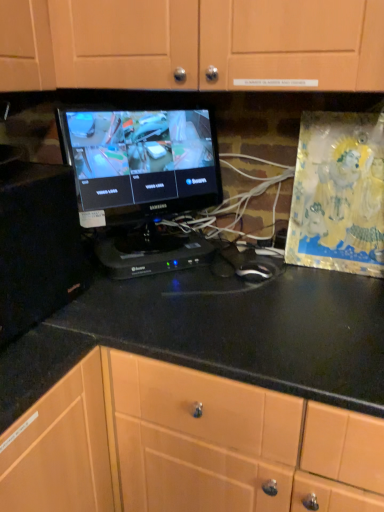
What do you see at coordinates (190, 42) in the screenshot? I see `matte wood cabinet at upper center, marked as the first cabinetry in a top-to-bottom arrangement` at bounding box center [190, 42].

Where is `black matte cabinet at left, which ranks as the 1th cabinetry in left-to-right order`? black matte cabinet at left, which ranks as the 1th cabinetry in left-to-right order is located at coordinates (37, 245).

Measure the distance between black glossy monitor at center and camera.

black glossy monitor at center is 39.07 inches from camera.

You are a GUI agent. You are given a task and a screenshot of the screen. Output one action in this format:
    pyautogui.click(x=<x>, y=<y>)
    Task: Click on the matte wood cabinet at upper center, which is the 2th cabinetry in bottom-to-top order
    This screenshot has height=512, width=384.
    Given the screenshot: What is the action you would take?
    pyautogui.click(x=190, y=42)

In the image, there is a matte wood cabinet at upper center, which is the 2th cabinetry from left to right. Where is `computer monitor below it (from a real-world perspective)`? This screenshot has height=512, width=384. computer monitor below it (from a real-world perspective) is located at coordinates (141, 182).

Can you tell me how much matte wood cabinet at upper center, which is the 2th cabinetry in bottom-to-top order, and black glossy monitor at center differ in facing direction?

They differ by 52.5 degrees in their facing directions.

From a real-world perspective, is matte wood cabinet at upper center, which is the 2th cabinetry in bottom-to-top order, located higher than black glossy monitor at center?

Yes.

Measure the distance between matte wood cabinet at upper center, the 1th cabinetry from the right, and black glossy monitor at center.

matte wood cabinet at upper center, the 1th cabinetry from the right, and black glossy monitor at center are 11.45 inches apart.

Which is correct: black glossy monitor at center is inside matte wood cabinet at upper center, which is the 2th cabinetry in bottom-to-top order, or outside of it?

black glossy monitor at center is spatially situated outside matte wood cabinet at upper center, which is the 2th cabinetry in bottom-to-top order.

Considering the positions of objects black glossy monitor at center and matte wood cabinet at upper center, the 1th cabinetry from the right, in the image provided, who is more to the left, black glossy monitor at center or matte wood cabinet at upper center, the 1th cabinetry from the right,?

black glossy monitor at center.

Can you tell me how much black glossy monitor at center and matte wood cabinet at upper center, which is the 2th cabinetry in bottom-to-top order, differ in facing direction?

52.5 degrees.

From the image's perspective, which one is positioned lower, black glossy monitor at center or matte wood cabinet at upper center, which is the 2th cabinetry from left to right?

black glossy monitor at center.

Looking at this image, what's the angular difference between black glossy countertop at center and black matte cabinet at left, which ranks as the 1th cabinetry in left-to-right order,'s facing directions?

Result: The angle between the facing direction of black glossy countertop at center and the facing direction of black matte cabinet at left, which ranks as the 1th cabinetry in left-to-right order, is 90.8 degrees.

Is black glossy countertop at center further to camera compared to black matte cabinet at left, which ranks as the 1th cabinetry in left-to-right order?

No, it is in front of black matte cabinet at left, which ranks as the 1th cabinetry in left-to-right order.

Which object is positioned more to the left, black glossy countertop at center or black matte cabinet at left, which ranks as the 1th cabinetry in left-to-right order?

Positioned to the left is black matte cabinet at left, which ranks as the 1th cabinetry in left-to-right order.

Is black glossy countertop at center looking in the opposite direction of black matte cabinet at left, the second cabinetry in the top-to-bottom sequence?

No, black matte cabinet at left, the second cabinetry in the top-to-bottom sequence, is not at the back of black glossy countertop at center.

Can you tell me how much black matte cabinet at left, which ranks as the first cabinetry in bottom-to-top order, and black glossy monitor at center differ in facing direction?

There is a 37.1-degree angle between the facing directions of black matte cabinet at left, which ranks as the first cabinetry in bottom-to-top order, and black glossy monitor at center.

Consider the image. Is black matte cabinet at left, which ranks as the 1th cabinetry in left-to-right order, taller than black glossy monitor at center?

No, black matte cabinet at left, which ranks as the 1th cabinetry in left-to-right order, is not taller than black glossy monitor at center.

In the image, is black matte cabinet at left, which ranks as the first cabinetry in bottom-to-top order, on the left side or the right side of black glossy monitor at center?

In the image, black matte cabinet at left, which ranks as the first cabinetry in bottom-to-top order, appears on the left side of black glossy monitor at center.

Is there a large distance between black matte cabinet at left, which ranks as the 1th cabinetry in left-to-right order, and black glossy monitor at center?

They are positioned close to each other.

From a real-world perspective, between matte wood cabinet at upper center, which is the 2th cabinetry in bottom-to-top order, and black matte cabinet at left, which is counted as the second cabinetry, starting from the right, who is vertically higher?

In real-world perspective, matte wood cabinet at upper center, which is the 2th cabinetry in bottom-to-top order, is above.

From the image's perspective, which one is positioned lower, matte wood cabinet at upper center, which is the 2th cabinetry from left to right, or black matte cabinet at left, the second cabinetry in the top-to-bottom sequence?

From the image's view, black matte cabinet at left, the second cabinetry in the top-to-bottom sequence, is below.

Considering the sizes of matte wood cabinet at upper center, which is the 2th cabinetry from left to right, and black matte cabinet at left, the second cabinetry in the top-to-bottom sequence, in the image, is matte wood cabinet at upper center, which is the 2th cabinetry from left to right, wider or thinner than black matte cabinet at left, the second cabinetry in the top-to-bottom sequence,?

matte wood cabinet at upper center, which is the 2th cabinetry from left to right, is wider than black matte cabinet at left, the second cabinetry in the top-to-bottom sequence.

Considering the relative positions of matte wood cabinet at upper center, marked as the first cabinetry in a top-to-bottom arrangement, and black matte cabinet at left, which is counted as the second cabinetry, starting from the right, in the image provided, is matte wood cabinet at upper center, marked as the first cabinetry in a top-to-bottom arrangement, to the right of black matte cabinet at left, which is counted as the second cabinetry, starting from the right, from the viewer's perspective?

Indeed, matte wood cabinet at upper center, marked as the first cabinetry in a top-to-bottom arrangement, is positioned on the right side of black matte cabinet at left, which is counted as the second cabinetry, starting from the right.

Is black glossy monitor at center aimed at black glossy countertop at center?

No, black glossy monitor at center is not facing towards black glossy countertop at center.

Based on the photo, can you tell me how much black glossy monitor at center and black glossy countertop at center differ in facing direction?

53.7 degrees.

From the image's perspective, is black glossy monitor at center beneath black glossy countertop at center?

No, from the image's perspective, black glossy monitor at center is not below black glossy countertop at center.

From a real-world perspective, is black glossy monitor at center over black glossy countertop at center?

Yes.

From their relative heights in the image, would you say black matte cabinet at left, the second cabinetry in the top-to-bottom sequence, is taller or shorter than matte wood cabinet at upper center, which is the 2th cabinetry in bottom-to-top order?

In the image, black matte cabinet at left, the second cabinetry in the top-to-bottom sequence, appears to be taller than matte wood cabinet at upper center, which is the 2th cabinetry in bottom-to-top order.

From the image's perspective, is black matte cabinet at left, the second cabinetry in the top-to-bottom sequence, above or below matte wood cabinet at upper center, which is the 2th cabinetry in bottom-to-top order?

black matte cabinet at left, the second cabinetry in the top-to-bottom sequence, is situated lower than matte wood cabinet at upper center, which is the 2th cabinetry in bottom-to-top order, in the image.

Is black matte cabinet at left, the second cabinetry in the top-to-bottom sequence, not near matte wood cabinet at upper center, which is the 2th cabinetry in bottom-to-top order?

No, there isn't a large distance between black matte cabinet at left, the second cabinetry in the top-to-bottom sequence, and matte wood cabinet at upper center, which is the 2th cabinetry in bottom-to-top order.

Based on the photo, does black matte cabinet at left, which ranks as the 1th cabinetry in left-to-right order, have a smaller size compared to matte wood cabinet at upper center, which is the 2th cabinetry from left to right?

Yes, black matte cabinet at left, which ranks as the 1th cabinetry in left-to-right order, is smaller than matte wood cabinet at upper center, which is the 2th cabinetry from left to right.

Locate an element on the screen. computer monitor below the matte wood cabinet at upper center, which is the 2th cabinetry in bottom-to-top order (from the image's perspective) is located at coordinates (141, 182).

What are the coordinates of `computer monitor below the matte wood cabinet at upper center, which is the 2th cabinetry from left to right (from a real-world perspective)` in the screenshot? It's located at (141, 182).

Estimate the real-world distances between objects in this image. Which object is closer to black glossy monitor at center, black glossy countertop at center or black matte cabinet at left, the second cabinetry in the top-to-bottom sequence?

Based on the image, black matte cabinet at left, the second cabinetry in the top-to-bottom sequence, appears to be nearer to black glossy monitor at center.

When comparing their distances from black glossy countertop at center, does matte wood cabinet at upper center, which is the 2th cabinetry in bottom-to-top order, or black matte cabinet at left, the second cabinetry in the top-to-bottom sequence, seem closer?

Among the two, black matte cabinet at left, the second cabinetry in the top-to-bottom sequence, is located nearer to black glossy countertop at center.

Considering their positions, is black matte cabinet at left, which ranks as the 1th cabinetry in left-to-right order, positioned closer to black glossy countertop at center than matte wood cabinet at upper center, which is the 2th cabinetry from left to right?

black matte cabinet at left, which ranks as the 1th cabinetry in left-to-right order, is positioned closer to the anchor black glossy countertop at center.

When comparing their distances from black glossy monitor at center, does matte wood cabinet at upper center, which is the 2th cabinetry from left to right, or black glossy countertop at center seem closer?

matte wood cabinet at upper center, which is the 2th cabinetry from left to right, lies closer to black glossy monitor at center than the other object.

From the image, which object appears to be nearer to black glossy monitor at center, black matte cabinet at left, which ranks as the 1th cabinetry in left-to-right order, or matte wood cabinet at upper center, marked as the first cabinetry in a top-to-bottom arrangement?

black matte cabinet at left, which ranks as the 1th cabinetry in left-to-right order, is positioned closer to the anchor black glossy monitor at center.

Estimate the real-world distances between objects in this image. Which object is further from matte wood cabinet at upper center, marked as the first cabinetry in a top-to-bottom arrangement, black glossy monitor at center or black glossy countertop at center?

black glossy countertop at center.

Which object lies nearer to the anchor point black glossy monitor at center, matte wood cabinet at upper center, which is the 2th cabinetry from left to right, or black matte cabinet at left, which ranks as the 1th cabinetry in left-to-right order?

black matte cabinet at left, which ranks as the 1th cabinetry in left-to-right order.

Estimate the real-world distances between objects in this image. Which object is further from black glossy countertop at center, black glossy monitor at center or matte wood cabinet at upper center, marked as the first cabinetry in a top-to-bottom arrangement?

The object further to black glossy countertop at center is matte wood cabinet at upper center, marked as the first cabinetry in a top-to-bottom arrangement.

This screenshot has height=512, width=384. I want to click on cabinetry between matte wood cabinet at upper center, which is the 2th cabinetry from left to right, and black glossy countertop at center, in the vertical direction, so click(x=37, y=245).

Identify the location of computer monitor between matte wood cabinet at upper center, marked as the first cabinetry in a top-to-bottom arrangement, and black matte cabinet at left, which ranks as the 1th cabinetry in left-to-right order, vertically. (141, 182).

I want to click on computer monitor between matte wood cabinet at upper center, which is the 2th cabinetry in bottom-to-top order, and black glossy countertop at center from top to bottom, so click(x=141, y=182).

I want to click on cabinetry between black glossy monitor at center and black glossy countertop at center in the up-down direction, so 37,245.